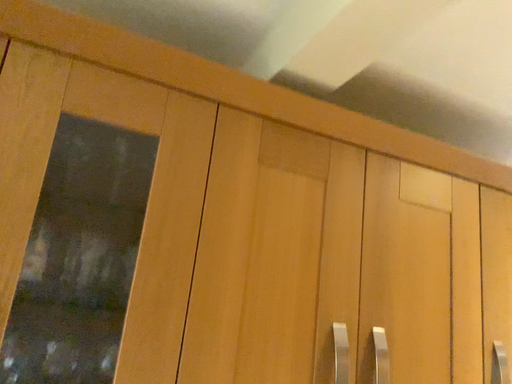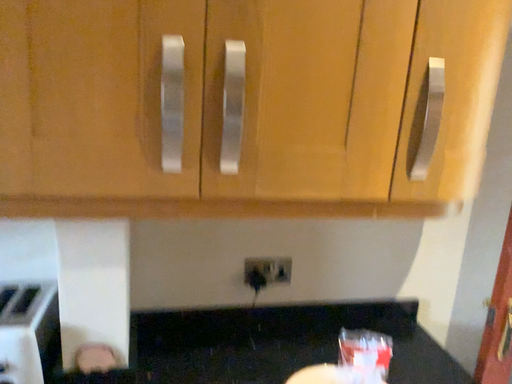
Question: Which way did the camera rotate in the video?

Choices:
 (A) rotated downward
 (B) rotated upward

Answer: (A)